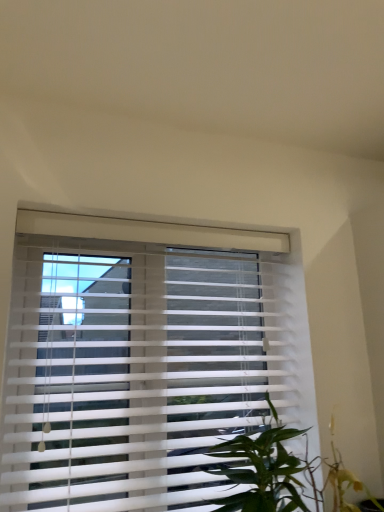
In order to face green leafy plant at lower right, should I rotate leftwards or rightwards?

You should rotate right by 12.977 degrees.

This screenshot has width=384, height=512. What do you see at coordinates (261, 469) in the screenshot?
I see `green leafy plant at lower right` at bounding box center [261, 469].

Image resolution: width=384 pixels, height=512 pixels. I want to click on green leafy plant at lower right, so coord(261,469).

The image size is (384, 512). I want to click on white plastic blinds at center, so click(x=143, y=359).

This screenshot has height=512, width=384. What do you see at coordinates (143, 359) in the screenshot?
I see `white plastic blinds at center` at bounding box center [143, 359].

You are a GUI agent. You are given a task and a screenshot of the screen. Output one action in this format:
    pyautogui.click(x=<x>, y=<y>)
    Task: Click on the green leafy plant at lower right
    
    Given the screenshot: What is the action you would take?
    pyautogui.click(x=261, y=469)

Does green leafy plant at lower right appear on the right side of white plastic blinds at center?

Correct, you'll find green leafy plant at lower right to the right of white plastic blinds at center.

Does green leafy plant at lower right come in front of white plastic blinds at center?

Yes, green leafy plant at lower right is closer to the viewer.

Is point (217, 465) closer to camera compared to point (208, 234)?

That is True.

From the image's perspective, is green leafy plant at lower right positioned above or below white plastic blinds at center?

Clearly, from the image's perspective, green leafy plant at lower right is below white plastic blinds at center.

From a real-world perspective, is green leafy plant at lower right positioned above or below white plastic blinds at center?

Clearly, from a real-world perspective, green leafy plant at lower right is below white plastic blinds at center.

Which object is thinner, green leafy plant at lower right or white plastic blinds at center?

white plastic blinds at center.

Considering the relative sizes of green leafy plant at lower right and white plastic blinds at center in the image provided, is green leafy plant at lower right taller than white plastic blinds at center?

In fact, green leafy plant at lower right may be shorter than white plastic blinds at center.

Based on their sizes in the image, would you say green leafy plant at lower right is bigger or smaller than white plastic blinds at center?

Clearly, green leafy plant at lower right is smaller in size than white plastic blinds at center.

Is green leafy plant at lower right inside the boundaries of white plastic blinds at center, or outside?

The correct answer is: outside.

Is green leafy plant at lower right next to white plastic blinds at center?

No, green leafy plant at lower right is not next to white plastic blinds at center.

Could you tell me if green leafy plant at lower right is facing white plastic blinds at center?

No.

How different are the orientations of green leafy plant at lower right and white plastic blinds at center in degrees?

6.12 degrees separate the facing orientations of green leafy plant at lower right and white plastic blinds at center.

Where is `vegetation below the white plastic blinds at center (from a real-world perspective)`? vegetation below the white plastic blinds at center (from a real-world perspective) is located at coordinates (261, 469).

Which is more to the right, white plastic blinds at center or green leafy plant at lower right?

Positioned to the right is green leafy plant at lower right.

Between white plastic blinds at center and green leafy plant at lower right, which one is positioned behind?

Positioned behind is white plastic blinds at center.

Between point (103, 496) and point (276, 426), which one is positioned behind?

The point (276, 426) is more distant.

From the image's perspective, which is below, white plastic blinds at center or green leafy plant at lower right?

From the image's view, green leafy plant at lower right is below.

From a real-world perspective, is white plastic blinds at center positioned under green leafy plant at lower right based on gravity?

No, from a real-world perspective, white plastic blinds at center is not below green leafy plant at lower right.

Between white plastic blinds at center and green leafy plant at lower right, which one has smaller width?

white plastic blinds at center is thinner.

From their relative heights in the image, would you say white plastic blinds at center is taller or shorter than green leafy plant at lower right?

Considering their sizes, white plastic blinds at center has more height than green leafy plant at lower right.

Considering the relative sizes of white plastic blinds at center and green leafy plant at lower right in the image provided, is white plastic blinds at center bigger than green leafy plant at lower right?

Indeed, white plastic blinds at center has a larger size compared to green leafy plant at lower right.

Is white plastic blinds at center surrounding green leafy plant at lower right?

Definitely not — green leafy plant at lower right is not inside white plastic blinds at center.

Is white plastic blinds at center positioned far away from green leafy plant at lower right?

That's not correct — white plastic blinds at center is a little close to green leafy plant at lower right.

Could you tell me if white plastic blinds at center is facing green leafy plant at lower right?

Yes, white plastic blinds at center is oriented towards green leafy plant at lower right.

I want to click on vegetation directly beneath the white plastic blinds at center (from a real-world perspective), so click(261, 469).

Where is `window blind above the green leafy plant at lower right (from a real-world perspective)`? This screenshot has height=512, width=384. window blind above the green leafy plant at lower right (from a real-world perspective) is located at coordinates (143, 359).

In order to click on window blind behind the green leafy plant at lower right in this screenshot , I will do `click(143, 359)`.